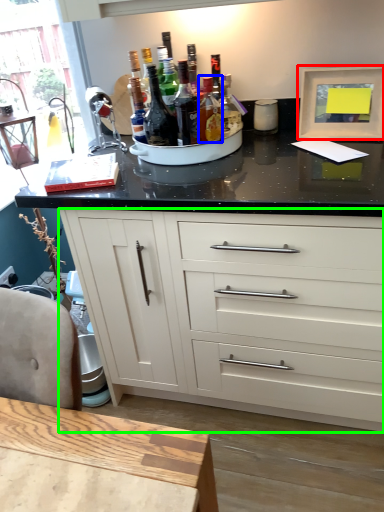
Question: Considering the real-world distances, which object is closest to picture frame (highlighted by a red box)? bottle (highlighted by a blue box) or cabinetry (highlighted by a green box).

Choices:
 (A) bottle
 (B) cabinetry

Answer: (A)